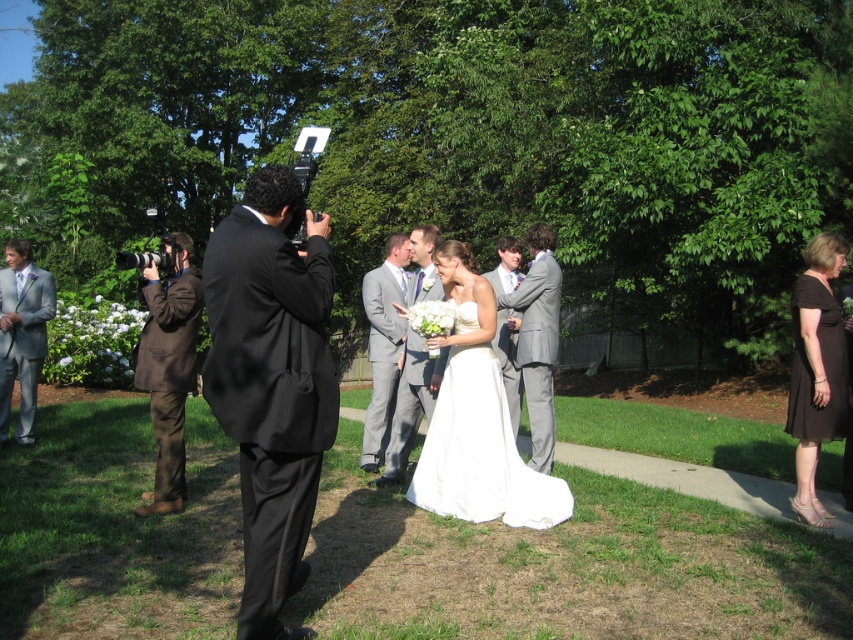
Can you confirm if gray satin suit at center is positioned above light gray suit at center?

Incorrect, gray satin suit at center is not positioned above light gray suit at center.

Does gray satin suit at center appear on the left side of light gray suit at center?

Indeed, gray satin suit at center is positioned on the left side of light gray suit at center.

Is point (375, 451) less distant than point (438, 385)?

No, (375, 451) is further to viewer.

You are a GUI agent. You are given a task and a screenshot of the screen. Output one action in this format:
    pyautogui.click(x=<x>, y=<y>)
    Task: Click on the gray satin suit at center
    
    Given the screenshot: What is the action you would take?
    [x=383, y=346]

Does point (477, 474) come closer to viewer compared to point (817, 440)?

No, (477, 474) is behind (817, 440).

Which is behind, point (479, 385) or point (816, 419)?

The point (479, 385) is behind.

Does point (508, 449) lie behind point (808, 371)?

Yes, it is.

Where is `white satin dress at center`? Image resolution: width=853 pixels, height=640 pixels. white satin dress at center is located at coordinates (480, 452).

Is brown wool suit at left positioned before light gray suit at left?

Answer: That is True.

Between brown wool suit at left and light gray suit at left, which one has more height?

With more height is brown wool suit at left.

Locate an element on the screen. Image resolution: width=853 pixels, height=640 pixels. brown wool suit at left is located at coordinates tap(167, 368).

The width and height of the screenshot is (853, 640). In order to click on brown wool suit at left in this screenshot , I will do `click(167, 368)`.